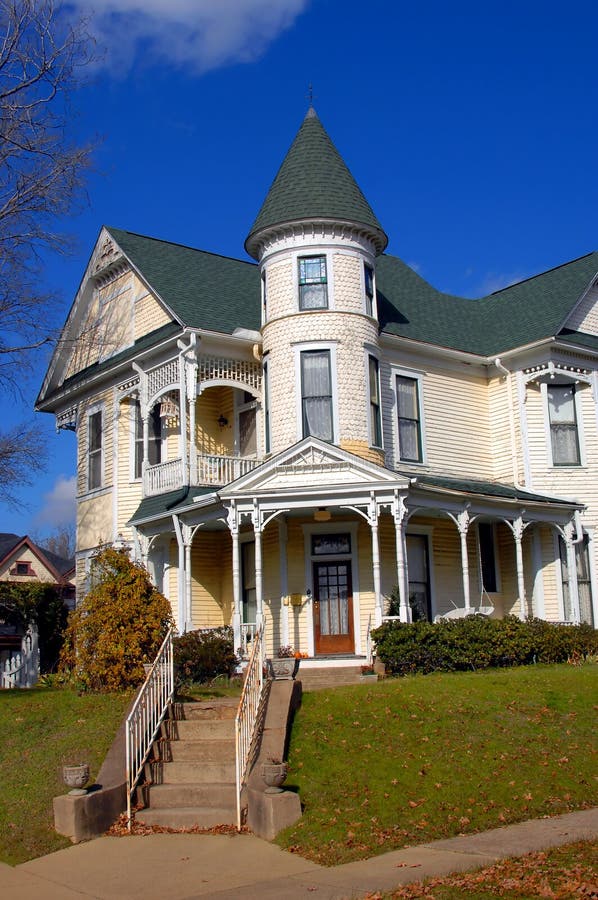
This screenshot has height=900, width=598. Find the location of `handrail`. handrail is located at coordinates (147, 679), (245, 681).